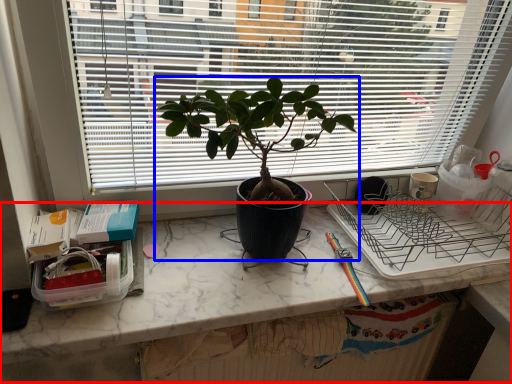
Question: Which object appears farthest to the camera in this image, computer desk (highlighted by a red box) or houseplant (highlighted by a blue box)?

Choices:
 (A) computer desk
 (B) houseplant

Answer: (A)